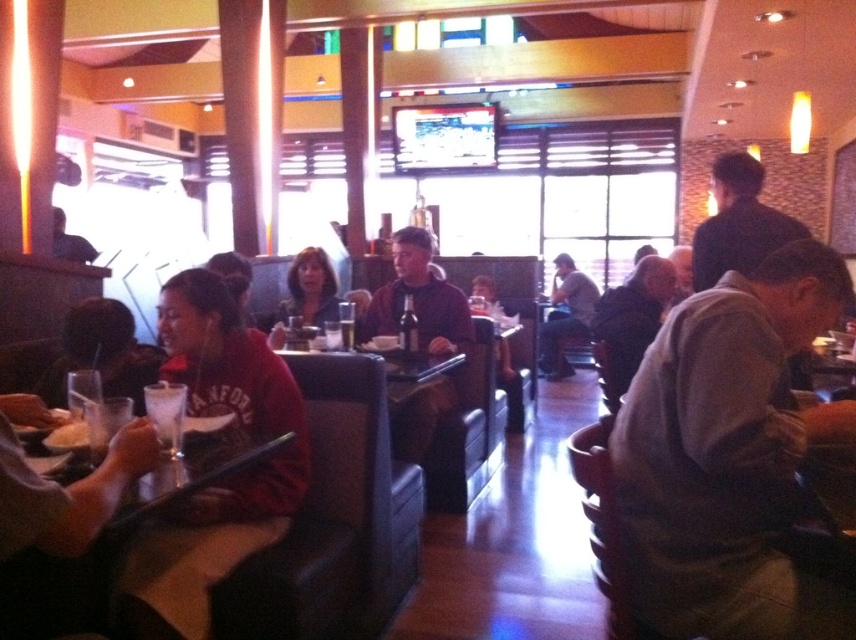
You are a waiter in a restaurant and you see a customer wearing a gray fabric shirt at lower right and another customer with dark brown hair at upper right. Which customer is sitting closer to the floor?

The gray fabric shirt at lower right is positioned under dark brown hair at upper right, so the customer wearing the gray fabric shirt at lower right is sitting closer to the floor.

You are a server in the restaurant and need to deliver a drink to the patron wearing the gray fabric shirt at lower right. Based on the coordinates provided, can you estimate the direction you should walk from the entrance located at the front of the image?

The gray fabric shirt at lower right is located at point (730,456), which means it is positioned towards the lower right corner of the image. Since the entrance is at the front, you should walk towards the lower right direction to reach the patron.